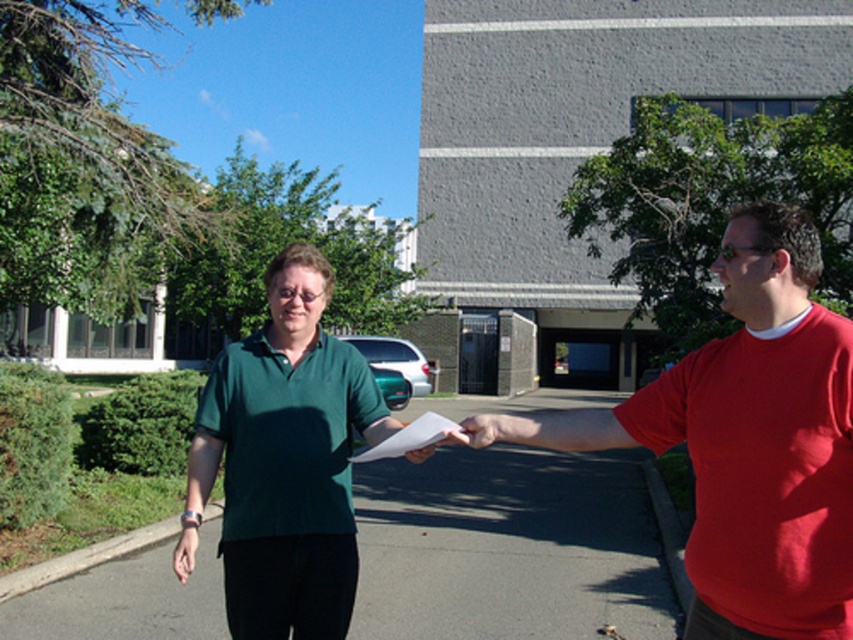
Question: Does green matte shirt at center come in front of matte white paper at center?

Choices:
 (A) no
 (B) yes

Answer: (A)

Question: Can you confirm if green matte shirt at center is smaller than matte white paper at center?

Choices:
 (A) yes
 (B) no

Answer: (B)

Question: Can you confirm if red matte shirt at right is positioned to the right of green matte shirt at center?

Choices:
 (A) yes
 (B) no

Answer: (A)

Question: Which object is farther from the camera taking this photo?

Choices:
 (A) green matte shirt at center
 (B) red matte shirt at right

Answer: (A)

Question: Which point is farther to the camera?

Choices:
 (A) green matte shirt at center
 (B) red matte shirt at right
 (C) matte white paper at center

Answer: (A)

Question: Which object is closer to the camera taking this photo?

Choices:
 (A) red matte shirt at right
 (B) matte white paper at center

Answer: (A)